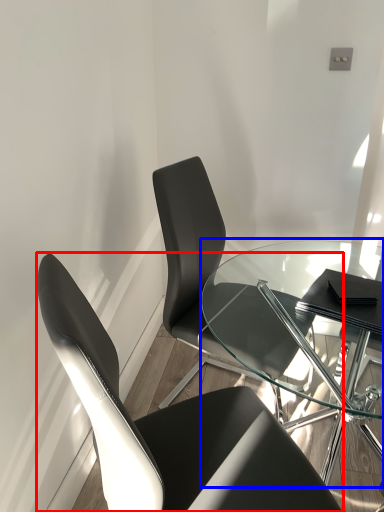
Question: Which object appears farthest to the camera in this image, chair (highlighted by a red box) or table (highlighted by a blue box)?

Choices:
 (A) chair
 (B) table

Answer: (B)